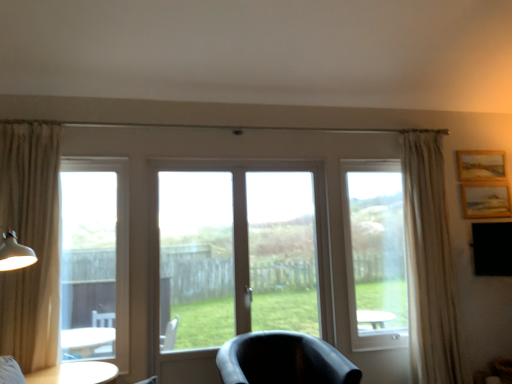
Question: Does point (291, 337) appear closer or farther from the camera than point (81, 238)?

Choices:
 (A) closer
 (B) farther

Answer: (A)

Question: From a real-world perspective, is matte black chair at center physically located above or below clear glass window at left?

Choices:
 (A) below
 (B) above

Answer: (A)

Question: Which is nearer to the white sheer curtain at right, the first curtain when ordered from back to front?

Choices:
 (A) white glossy table at lower left
 (B) wooden textured picture frame at upper right, positioned as the second picture frame in top-to-bottom order
 (C) transparent glass window at right
 (D) clear glass window at left
 (E) wooden framed picture at upper right, marked as the 2th picture frame in a bottom-to-top arrangement

Answer: (C)

Question: Based on their relative distances, which object is farther from the transparent glass screen door at center?

Choices:
 (A) matte white table lamp at left
 (B) wooden framed picture at upper right, marked as the 2th picture frame in a bottom-to-top arrangement
 (C) wooden textured picture frame at upper right, positioned as the second picture frame in top-to-bottom order
 (D) transparent glass window at right
 (E) beige fabric curtain at left, which ranks as the 1th curtain in left-to-right order

Answer: (B)